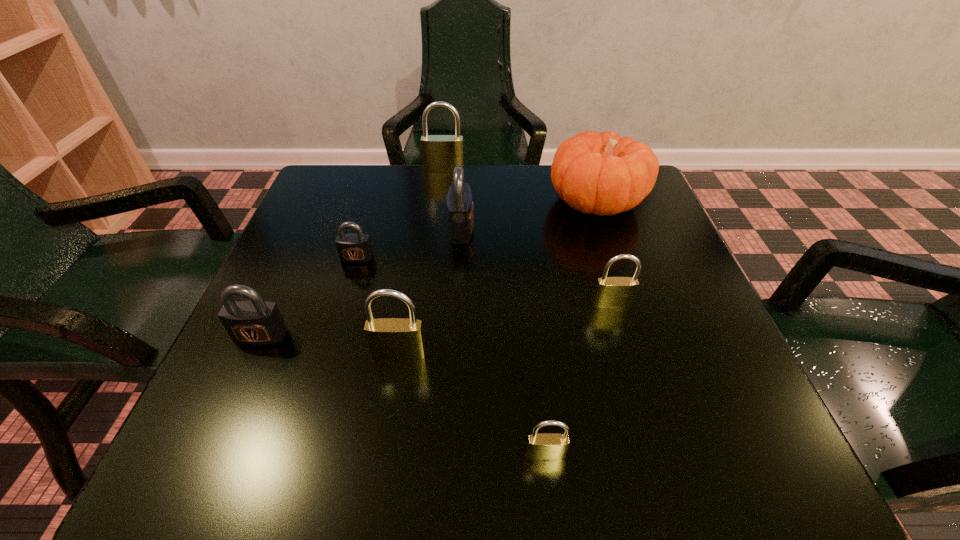
The image size is (960, 540). Find the location of `the farthest object`. the farthest object is located at coordinates (440, 153).

Find the location of a particular element. This screenshot has height=540, width=960. the tallest padlock is located at coordinates (440, 153).

Find the location of a particular element. Image resolution: width=960 pixels, height=540 pixels. pumpkin is located at coordinates (596, 173).

At what (x,y) coordinates should I click in order to perform the action: click on the farthest gray padlock. Please return your answer as a coordinate pair (x, y). Looking at the image, I should click on (460, 214).

Where is `the sixth nearest padlock`? This screenshot has width=960, height=540. the sixth nearest padlock is located at coordinates (460, 214).

At what (x,y) coordinates should I click in order to perform the action: click on the seventh farthest object. Please return your answer as a coordinate pair (x, y). The image size is (960, 540). Looking at the image, I should click on (388, 338).

What are the coordinates of `the second nearest brass padlock` in the screenshot? It's located at (388, 338).

Locate an element on the screen. the leftmost padlock is located at coordinates (252, 322).

The width and height of the screenshot is (960, 540). What are the coordinates of `the leftmost object` in the screenshot? It's located at click(x=252, y=322).

This screenshot has height=540, width=960. Find the location of `the fourth nearest padlock`. the fourth nearest padlock is located at coordinates (611, 292).